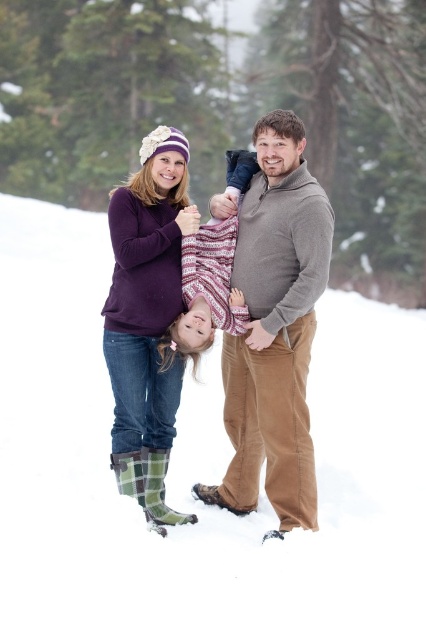
You are a photographer trying to capture the family in the snow. You want to ensure that both the plaid wool boots at lower left and the knitted sweater at center are visible in the frame. Based on their positions, which object should you focus on first to ensure both are in focus?

The plaid wool boots at lower left is below the knitted sweater at center, so focusing on the knitted sweater at center first will ensure both are in focus as the boots are closer to the camera.

You are a photographer trying to capture the family in the snow. You want to ensure that both the brown corduroy pants at center and the knitted sweater at center are clearly visible in your shot. Which clothing item should you focus on to ensure the entire item is in frame, considering their widths?

The brown corduroy pants at center is wider than the knitted sweater at center, so focusing on the brown corduroy pants at center ensures the entire item is captured in the frame.